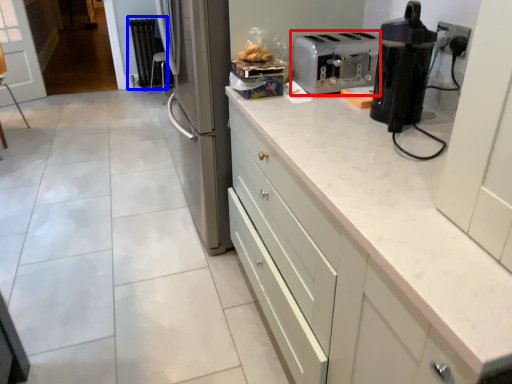
Question: Among these objects, which one is nearest to the camera, kitchen appliance (highlighted by a red box) or radiator (highlighted by a blue box)?

Choices:
 (A) kitchen appliance
 (B) radiator

Answer: (A)